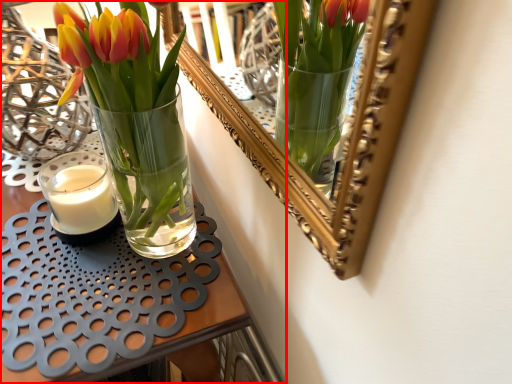
Question: From the image's perspective, what is the correct spatial relationship of table (annotated by the red box) in relation to candle?

Choices:
 (A) above
 (B) below

Answer: (B)